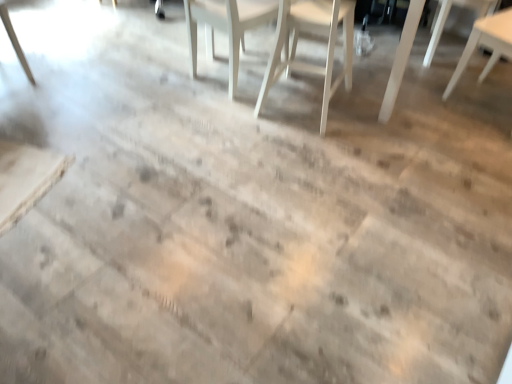
The width and height of the screenshot is (512, 384). Describe the element at coordinates (316, 32) in the screenshot. I see `white wood chair at center, the 3th chair in the right-to-left sequence` at that location.

What do you see at coordinates (447, 17) in the screenshot?
I see `white wood chair at upper right, placed as the 2th chair when sorted from right to left` at bounding box center [447, 17].

Where is `white wood chair at upper right, positioned as the 1th chair in right-to-left order`? white wood chair at upper right, positioned as the 1th chair in right-to-left order is located at coordinates (485, 44).

The image size is (512, 384). What do you see at coordinates (485, 44) in the screenshot? I see `white wood chair at upper right, positioned as the 1th chair in right-to-left order` at bounding box center [485, 44].

You are a GUI agent. You are given a task and a screenshot of the screen. Output one action in this format:
    pyautogui.click(x=<x>, y=<y>)
    Task: Click on the white wood chair at center, the 4th chair positioned from the right
    This screenshot has height=384, width=512.
    Given the screenshot: What is the action you would take?
    pyautogui.click(x=226, y=27)

Who is bigger, white wood chair at upper right, placed as the 2th chair when sorted from right to left, or light brown wood table at lower left?

white wood chair at upper right, placed as the 2th chair when sorted from right to left.

Is white wood chair at upper right, placed as the 2th chair when sorted from right to left, positioned with its back to light brown wood table at lower left?

white wood chair at upper right, placed as the 2th chair when sorted from right to left, does not have its back to light brown wood table at lower left.

From a real-world perspective, which object stands above the other?

white wood chair at upper right, placed as the 2th chair when sorted from right to left, from a real-world perspective.

From a real-world perspective, is white wood chair at upper right, which is the 4th chair in left-to-right order, beneath white wood chair at center, the first chair when ordered from left to right?

No.

Is white wood chair at upper right, positioned as the 1th chair in right-to-left order, in contact with white wood chair at center, the first chair when ordered from left to right?

white wood chair at upper right, positioned as the 1th chair in right-to-left order, is not next to white wood chair at center, the first chair when ordered from left to right, and they're not touching.

Considering the positions of objects white wood chair at upper right, which is the 4th chair in left-to-right order, and white wood chair at center, the 4th chair positioned from the right, in the image provided, who is in front, white wood chair at upper right, which is the 4th chair in left-to-right order, or white wood chair at center, the 4th chair positioned from the right,?

white wood chair at upper right, which is the 4th chair in left-to-right order, is more forward.

Is white wood chair at center, the 3th chair in the right-to-left sequence, taller than white wood chair at upper right, the third chair in the left-to-right sequence?

Indeed, white wood chair at center, the 3th chair in the right-to-left sequence, has a greater height compared to white wood chair at upper right, the third chair in the left-to-right sequence.

Which is behind, point (322, 115) or point (434, 52)?

Point (434, 52)

From the image's perspective, is white wood chair at center, which appears as the 2th chair when viewed from the left, below white wood chair at upper right, the third chair in the left-to-right sequence?

Yes, from the image's perspective, white wood chair at center, which appears as the 2th chair when viewed from the left, is below white wood chair at upper right, the third chair in the left-to-right sequence.

Which object is positioned more to the right, white wood chair at center, the 3th chair in the right-to-left sequence, or white wood chair at upper right, the third chair in the left-to-right sequence?

From the viewer's perspective, white wood chair at upper right, the third chair in the left-to-right sequence, appears more on the right side.

From the image's perspective, relative to white wood chair at upper right, which is the 4th chair in left-to-right order, is white wood chair at center, the 3th chair in the right-to-left sequence, above or below?

Based on their image positions, white wood chair at center, the 3th chair in the right-to-left sequence, is located above white wood chair at upper right, which is the 4th chair in left-to-right order.

This screenshot has height=384, width=512. Find the location of `chair below the white wood chair at center, which appears as the 2th chair when viewed from the left (from the image's perspective)`. chair below the white wood chair at center, which appears as the 2th chair when viewed from the left (from the image's perspective) is located at coordinates (485, 44).

Which of these two, white wood chair at center, which appears as the 2th chair when viewed from the left, or white wood chair at upper right, which is the 4th chair in left-to-right order, stands shorter?

Standing shorter between the two is white wood chair at upper right, which is the 4th chair in left-to-right order.

Considering the positions of objects white wood chair at center, the 3th chair in the right-to-left sequence, and white wood chair at upper right, positioned as the 1th chair in right-to-left order, in the image provided, who is more to the right, white wood chair at center, the 3th chair in the right-to-left sequence, or white wood chair at upper right, positioned as the 1th chair in right-to-left order,?

white wood chair at upper right, positioned as the 1th chair in right-to-left order, is more to the right.

Considering the relative positions of white wood chair at center, the first chair when ordered from left to right, and white wood chair at center, which appears as the 2th chair when viewed from the left, in the image provided, is white wood chair at center, the first chair when ordered from left to right, to the left or to the right of white wood chair at center, which appears as the 2th chair when viewed from the left,?

white wood chair at center, the first chair when ordered from left to right, is to the left of white wood chair at center, which appears as the 2th chair when viewed from the left.

From a real-world perspective, does white wood chair at center, the 4th chair positioned from the right, sit lower than white wood chair at center, which appears as the 2th chair when viewed from the left?

Correct, in the physical world, white wood chair at center, the 4th chair positioned from the right, is lower than white wood chair at center, which appears as the 2th chair when viewed from the left.

Considering their positions, is white wood chair at center, the first chair when ordered from left to right, located in front of or behind white wood chair at center, the 3th chair in the right-to-left sequence?

Clearly, white wood chair at center, the first chair when ordered from left to right, is behind white wood chair at center, the 3th chair in the right-to-left sequence.

Does point (188, 42) lie behind point (285, 40)?

That is True.

What's the angular difference between white wood chair at center, the 4th chair positioned from the right, and white wood chair at upper right, placed as the 2th chair when sorted from right to left,'s facing directions?

171 degrees separate the facing orientations of white wood chair at center, the 4th chair positioned from the right, and white wood chair at upper right, placed as the 2th chair when sorted from right to left.

How much distance is there between white wood chair at center, the first chair when ordered from left to right, and white wood chair at upper right, placed as the 2th chair when sorted from right to left?

white wood chair at center, the first chair when ordered from left to right, and white wood chair at upper right, placed as the 2th chair when sorted from right to left, are 1.30 meters apart.

From a real-world perspective, which is physically below, white wood chair at center, the first chair when ordered from left to right, or white wood chair at upper right, placed as the 2th chair when sorted from right to left?

white wood chair at upper right, placed as the 2th chair when sorted from right to left, from a real-world perspective.

Would you consider white wood chair at center, the 4th chair positioned from the right, to be distant from white wood chair at upper right, the third chair in the left-to-right sequence?

Yes, white wood chair at center, the 4th chair positioned from the right, is far from white wood chair at upper right, the third chair in the left-to-right sequence.

In terms of size, does white wood chair at center, the 4th chair positioned from the right, appear bigger or smaller than white wood chair at upper right, positioned as the 1th chair in right-to-left order?

In the image, white wood chair at center, the 4th chair positioned from the right, appears to be smaller than white wood chair at upper right, positioned as the 1th chair in right-to-left order.

Could white wood chair at upper right, positioned as the 1th chair in right-to-left order, be considered to be inside white wood chair at center, the first chair when ordered from left to right?

No, white wood chair at upper right, positioned as the 1th chair in right-to-left order, is located outside of white wood chair at center, the first chair when ordered from left to right.

How many degrees apart are the facing directions of white wood chair at center, the 4th chair positioned from the right, and white wood chair at upper right, which is the 4th chair in left-to-right order?

They differ by 82.4 degrees in their facing directions.

Is white wood chair at center, the first chair when ordered from left to right, facing towards white wood chair at upper right, positioned as the 1th chair in right-to-left order?

No, white wood chair at center, the first chair when ordered from left to right, is not oriented towards white wood chair at upper right, positioned as the 1th chair in right-to-left order.

Locate an element on the screen. The height and width of the screenshot is (384, 512). chair that is the 1st one above the light brown wood table at lower left (from a real-world perspective) is located at coordinates (447, 17).

Where is `the 2nd chair above the white wood chair at upper right, positioned as the 1th chair in right-to-left order (from the image's perspective)`? This screenshot has height=384, width=512. the 2nd chair above the white wood chair at upper right, positioned as the 1th chair in right-to-left order (from the image's perspective) is located at coordinates (226, 27).

From the image, which object appears to be nearer to white wood chair at upper right, placed as the 2th chair when sorted from right to left, light brown wood table at lower left or white wood chair at center, the first chair when ordered from left to right?

Among the two, white wood chair at center, the first chair when ordered from left to right, is located nearer to white wood chair at upper right, placed as the 2th chair when sorted from right to left.

Estimate the real-world distances between objects in this image. Which object is closer to white wood chair at center, the first chair when ordered from left to right, light brown wood table at lower left or white wood chair at center, the 3th chair in the right-to-left sequence?

white wood chair at center, the 3th chair in the right-to-left sequence, is closer to white wood chair at center, the first chair when ordered from left to right.

From the picture: When comparing their distances from white wood chair at center, the first chair when ordered from left to right, does light brown wood table at lower left or white wood chair at upper right, placed as the 2th chair when sorted from right to left, seem further?

white wood chair at upper right, placed as the 2th chair when sorted from right to left, is further to white wood chair at center, the first chair when ordered from left to right.

Considering their positions, is white wood chair at center, which appears as the 2th chair when viewed from the left, positioned closer to white wood chair at upper right, which is the 4th chair in left-to-right order, than white wood chair at center, the first chair when ordered from left to right?

white wood chair at center, which appears as the 2th chair when viewed from the left.

Which object lies nearer to the anchor point white wood chair at center, the 3th chair in the right-to-left sequence, white wood chair at upper right, the third chair in the left-to-right sequence, or white wood chair at upper right, positioned as the 1th chair in right-to-left order?

white wood chair at upper right, positioned as the 1th chair in right-to-left order, is positioned closer to the anchor white wood chair at center, the 3th chair in the right-to-left sequence.

When comparing their distances from white wood chair at center, the first chair when ordered from left to right, does white wood chair at center, the 3th chair in the right-to-left sequence, or white wood chair at upper right, the third chair in the left-to-right sequence, seem closer?

white wood chair at center, the 3th chair in the right-to-left sequence, lies closer to white wood chair at center, the first chair when ordered from left to right, than the other object.

When comparing their distances from white wood chair at center, the first chair when ordered from left to right, does white wood chair at upper right, placed as the 2th chair when sorted from right to left, or white wood chair at center, the 3th chair in the right-to-left sequence, seem closer?

The object closer to white wood chair at center, the first chair when ordered from left to right, is white wood chair at center, the 3th chair in the right-to-left sequence.

In the scene shown: Based on their spatial positions, is white wood chair at upper right, the third chair in the left-to-right sequence, or white wood chair at center, the first chair when ordered from left to right, closer to white wood chair at center, the 3th chair in the right-to-left sequence?

Based on the image, white wood chair at center, the first chair when ordered from left to right, appears to be nearer to white wood chair at center, the 3th chair in the right-to-left sequence.

Where is `chair situated between light brown wood table at lower left and white wood chair at center, the 3th chair in the right-to-left sequence, from left to right`? Image resolution: width=512 pixels, height=384 pixels. chair situated between light brown wood table at lower left and white wood chair at center, the 3th chair in the right-to-left sequence, from left to right is located at coordinates (226, 27).

Where is `chair between white wood chair at center, which appears as the 2th chair when viewed from the left, and white wood chair at upper right, positioned as the 1th chair in right-to-left order, from left to right`? This screenshot has height=384, width=512. chair between white wood chair at center, which appears as the 2th chair when viewed from the left, and white wood chair at upper right, positioned as the 1th chair in right-to-left order, from left to right is located at coordinates (447, 17).

You are a GUI agent. You are given a task and a screenshot of the screen. Output one action in this format:
    pyautogui.click(x=<x>, y=<y>)
    Task: Click on the chair between white wood chair at center, the first chair when ordered from left to right, and white wood chair at upper right, the third chair in the left-to-right sequence, from left to right
    
    Given the screenshot: What is the action you would take?
    pyautogui.click(x=316, y=32)